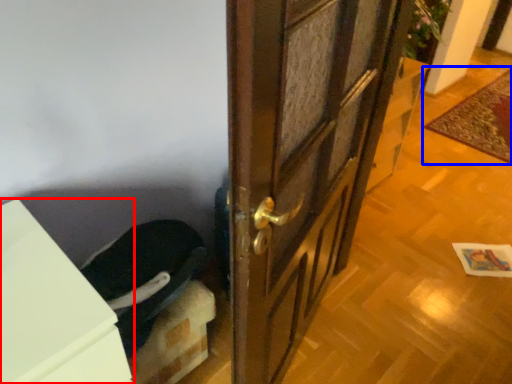
Question: Which object is closer to the camera taking this photo, cabinetry (highlighted by a red box) or doormat (highlighted by a blue box)?

Choices:
 (A) cabinetry
 (B) doormat

Answer: (A)